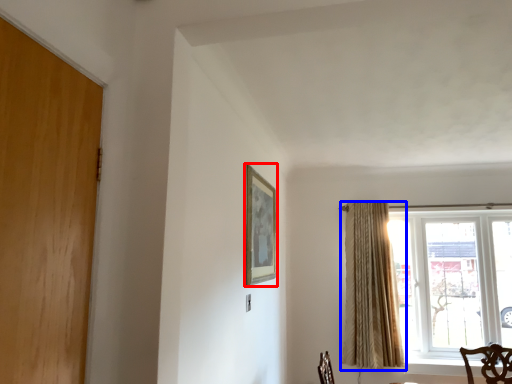
Question: Which object appears closest to the camera in this image, picture frame (highlighted by a red box) or curtain (highlighted by a blue box)?

Choices:
 (A) picture frame
 (B) curtain

Answer: (A)